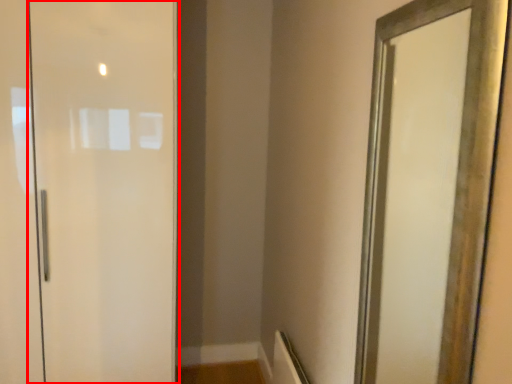
Question: From the image's perspective, where is door (annotated by the red box) located relative to mirror?

Choices:
 (A) below
 (B) above

Answer: (B)